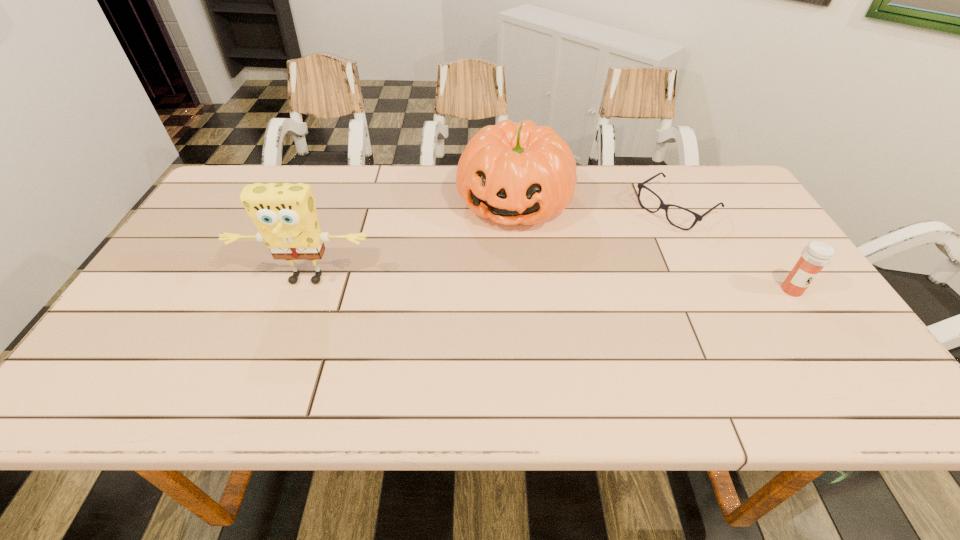
The image size is (960, 540). I want to click on vacant area that lies between the third object from left to right and the second object from left to right, so click(x=595, y=205).

Where is `vacant area between the sponge and the third tallest object`? vacant area between the sponge and the third tallest object is located at coordinates (549, 285).

This screenshot has width=960, height=540. What are the coordinates of `empty space that is in between the leftmost object and the second shortest object` in the screenshot? It's located at click(549, 285).

Image resolution: width=960 pixels, height=540 pixels. I want to click on blank region between the rightmost object and the second object from left to right, so click(x=653, y=246).

Where is `unoccupied position between the spectacles and the third object from right to left`? The width and height of the screenshot is (960, 540). unoccupied position between the spectacles and the third object from right to left is located at coordinates (595, 205).

This screenshot has width=960, height=540. I want to click on vacant area that lies between the rightmost object and the third object from right to left, so click(x=653, y=246).

Locate which object is the second closest to the rightmost object. Please provide its 2D coordinates. Your answer should be formatted as a tuple, i.e. [(x, y)], where the tuple contains the x and y coordinates of a point satisfying the conditions above.

[(512, 173)]

This screenshot has height=540, width=960. In order to click on object identified as the second closest to the shortest object in this screenshot , I will do `click(512, 173)`.

What are the coordinates of `free space in the image that satisfies the following two spatial constraints: 1. on the front side of the third object from left to right; 2. on the left side of the third object from right to left` in the screenshot? It's located at (516, 208).